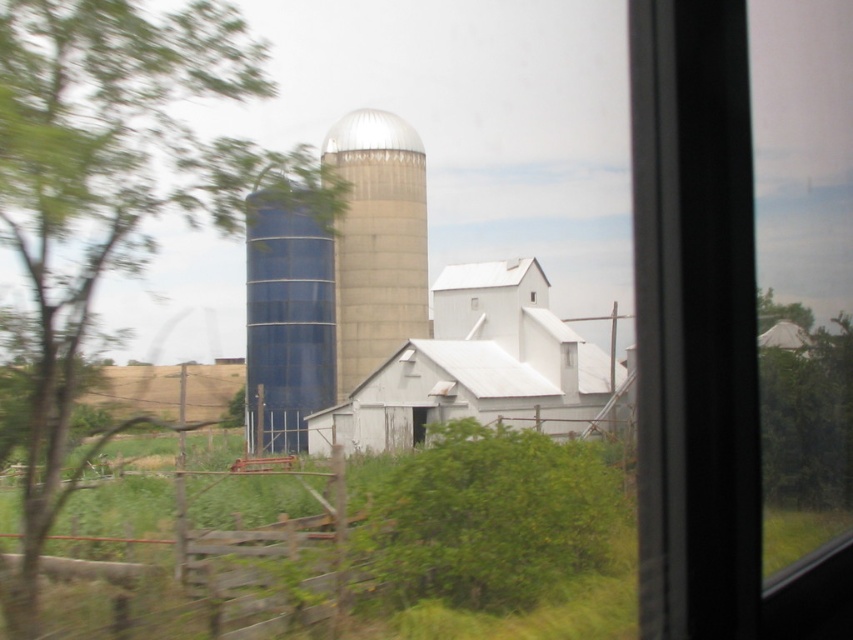
Question: Which object is farther from the camera taking this photo?

Choices:
 (A) white matte window at center
 (B) green leafy tree at right
 (C) blue metallic water tower at center-left

Answer: (A)

Question: Which point appears farthest from the camera in this image?

Choices:
 (A) (466, 304)
 (B) (531, 300)
 (C) (299, 348)
 (D) (314, 179)

Answer: (A)

Question: Can you confirm if white matte barn at center is thinner than green leafy tree at right?

Choices:
 (A) no
 (B) yes

Answer: (B)

Question: Does green leafy tree at left appear over blue metallic water tower at center-left?

Choices:
 (A) yes
 (B) no

Answer: (B)

Question: Which object is closer to the camera taking this photo?

Choices:
 (A) blue metallic water tower at center-left
 (B) white matte window at center

Answer: (A)

Question: Does white matte barn at center appear on the left side of blue metallic water tower at center-left?

Choices:
 (A) yes
 (B) no

Answer: (B)